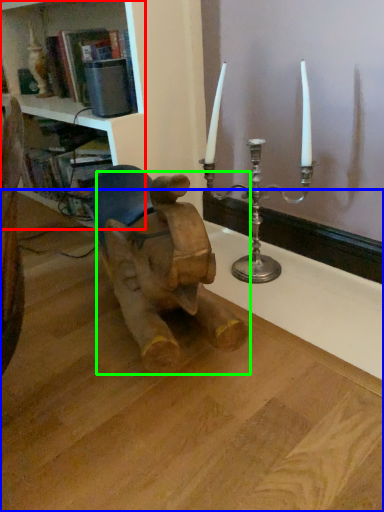
Question: Which is nearer to the shelf (highlighted by a red box)? table (highlighted by a blue box) or baby elephant (highlighted by a green box).

Choices:
 (A) table
 (B) baby elephant

Answer: (B)